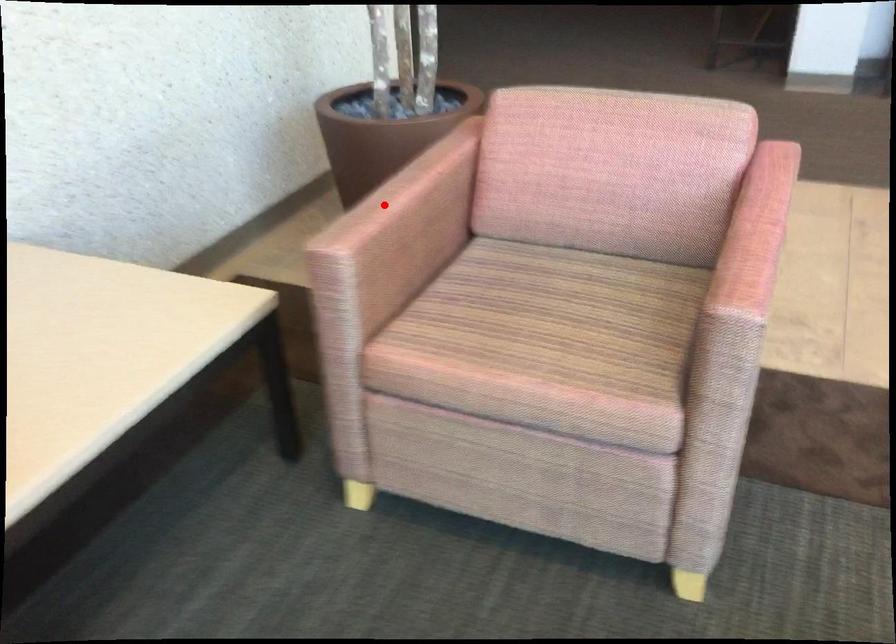
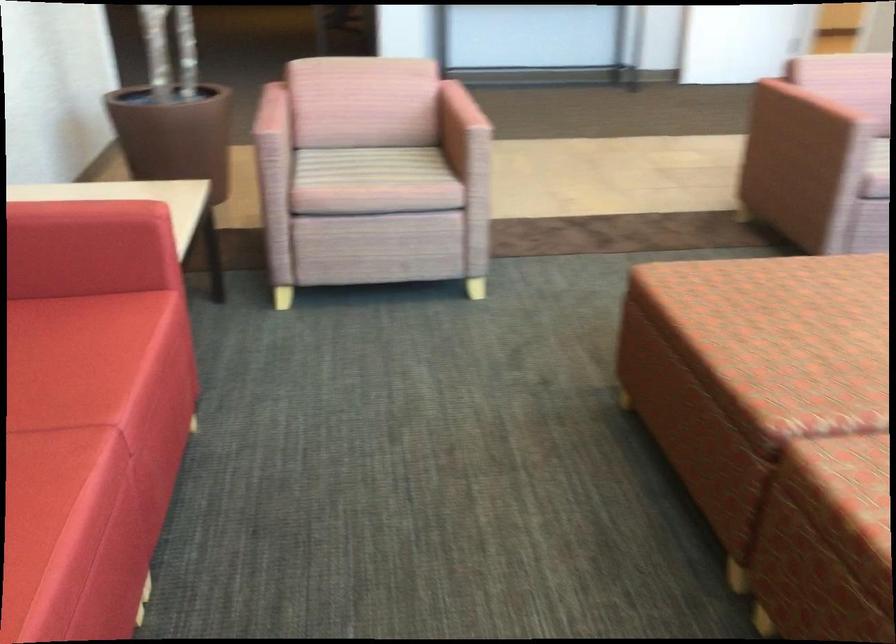
Question: I am providing you with two images of the same scene from different viewpoints. A red point is shown in image1. For the corresponding object point in image2, is it positioned nearer or farther from the camera?

Choices:
 (A) Nearer
 (B) Farther

Answer: (B)